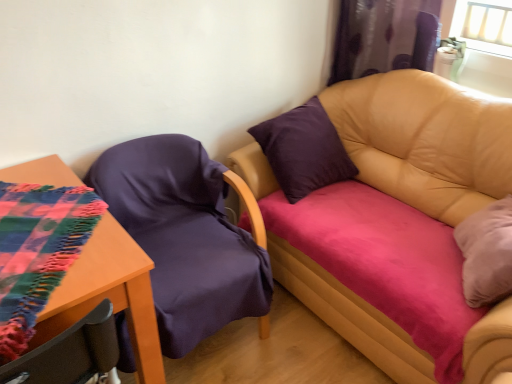
You are a GUI agent. You are given a task and a screenshot of the screen. Output one action in this format:
    pyautogui.click(x=<x>, y=<y>)
    Task: Click on the free spot above wooden table at lower left (from a real-world perspective)
    
    Given the screenshot: What is the action you would take?
    pyautogui.click(x=34, y=266)